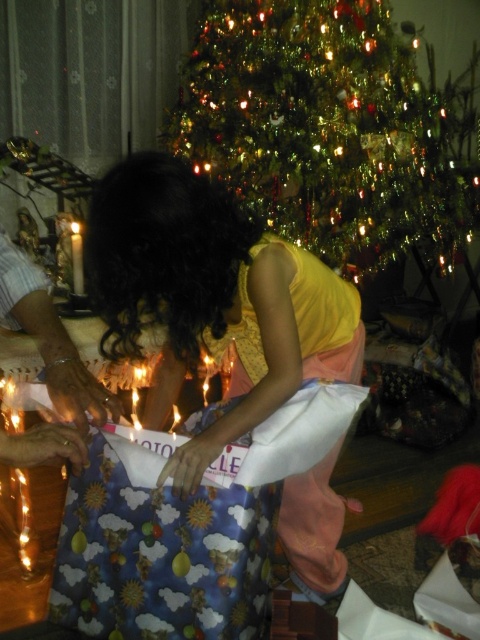
Question: Which of the following is the farthest from the observer?

Choices:
 (A) green shiny christmas tree at upper center
 (B) matte yellow shirt at center
 (C) white wax candle at center

Answer: (A)

Question: Among these objects, which one is nearest to the camera?

Choices:
 (A) white wax candle at center
 (B) matte yellow shirt at center

Answer: (B)

Question: Which point is closer to the camera?

Choices:
 (A) matte yellow shirt at center
 (B) green shiny christmas tree at upper center
 (C) white wax candle at center

Answer: (A)

Question: Can you confirm if matte yellow shirt at center is positioned to the left of white wax candle at center?

Choices:
 (A) yes
 (B) no

Answer: (B)

Question: Does green shiny christmas tree at upper center have a lesser width compared to white wax candle at center?

Choices:
 (A) yes
 (B) no

Answer: (B)

Question: Can you confirm if matte yellow shirt at center is positioned below white wax candle at center?

Choices:
 (A) no
 (B) yes

Answer: (B)